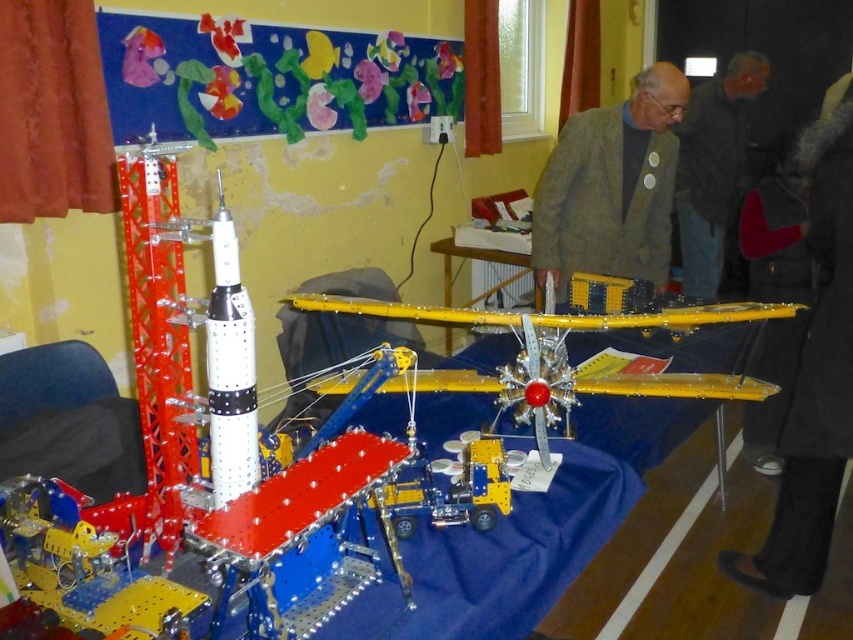
You are standing in front of the table with model projects. You need to place a new model airplane exactly where the dark brown leather jacket at upper right is currently located. Is this possible without moving any other objects?

The dark brown leather jacket at upper right is located at point (712,168). Since there is no mention of any objects occupying this coordinate in the scene description, it should be possible to place the new model airplane there without moving other objects.

You are organizing a fashion show and need to arrange the black fuzzy coat at lower right and the green textured blazer at center in order from left to right. Which should come first?

The green textured blazer at center should come first since the black fuzzy coat at lower right is positioned to its right side.

You are a visitor at an exhibition and want to take a photo of both the dark brown leather jacket at upper right and the white metallic rocket at center. However, you notice that one of them might be partially hidden by the other. Which object is taller and could potentially block the view of the other when taking the photo?

The dark brown leather jacket at upper right is taller than the white metallic rocket at center, so it might block the view of the rocket if positioned in front.